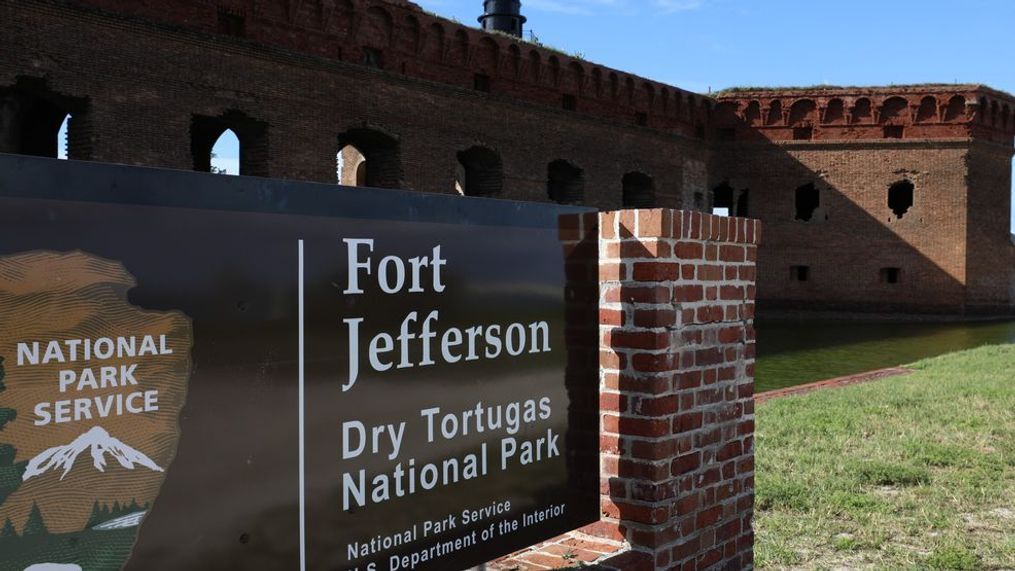
Identify the location of window. The image size is (1015, 571). [890, 195], [801, 201], [797, 279], [890, 272].